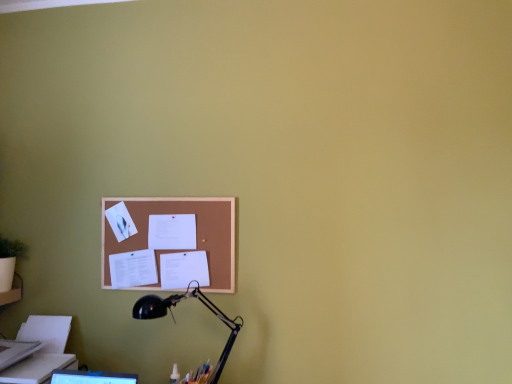
Question: Is corkboard at center shorter than black metal lamp at lower left?

Choices:
 (A) yes
 (B) no

Answer: (A)

Question: Is corkboard at center oriented away from black metal lamp at lower left?

Choices:
 (A) yes
 (B) no

Answer: (B)

Question: Does corkboard at center have a greater width compared to black metal lamp at lower left?

Choices:
 (A) no
 (B) yes

Answer: (A)

Question: Does corkboard at center come in front of black metal lamp at lower left?

Choices:
 (A) no
 (B) yes

Answer: (A)

Question: Would you say corkboard at center is outside black metal lamp at lower left?

Choices:
 (A) yes
 (B) no

Answer: (A)

Question: Is corkboard at center smaller than black metal lamp at lower left?

Choices:
 (A) yes
 (B) no

Answer: (A)

Question: Is white paper at center next to corkboard at center and touching it?

Choices:
 (A) yes
 (B) no

Answer: (A)

Question: Considering the relative positions of white paper at center and corkboard at center in the image provided, is white paper at center behind corkboard at center?

Choices:
 (A) no
 (B) yes

Answer: (B)

Question: Is white paper at center aimed at corkboard at center?

Choices:
 (A) yes
 (B) no

Answer: (A)

Question: Is white paper at center smaller than corkboard at center?

Choices:
 (A) no
 (B) yes

Answer: (B)

Question: Is white paper at center bigger than corkboard at center?

Choices:
 (A) no
 (B) yes

Answer: (A)

Question: Is white paper at center positioned in front of corkboard at center?

Choices:
 (A) yes
 (B) no

Answer: (B)

Question: Does corkboard at center come in front of white paper at center?

Choices:
 (A) no
 (B) yes

Answer: (B)